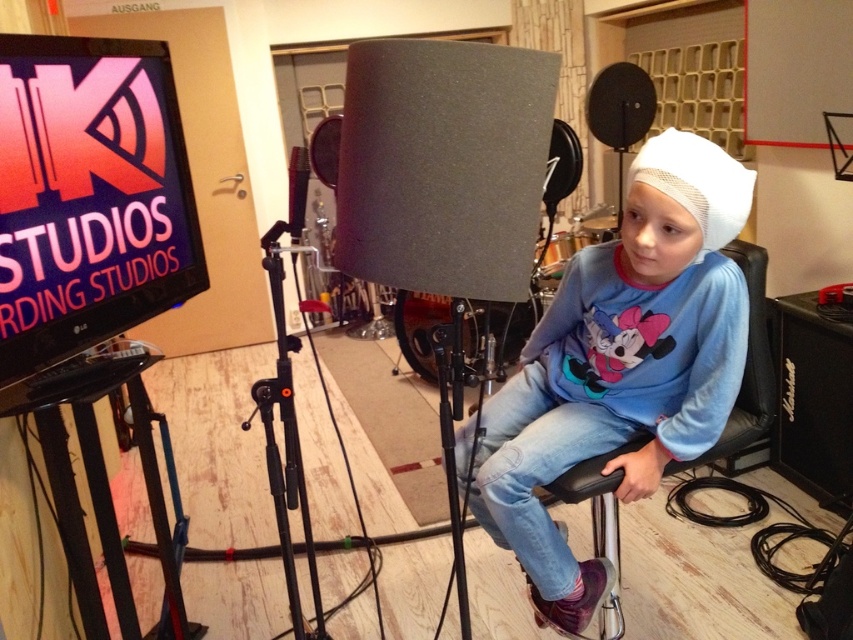
You are an interior designer planning to place a new lamp in the recording studio. The lamp needs to be positioned such that it doesn not cast a shadow on the white mesh hat at center. Given that the lamp will be placed at point A, which is at coordinates different from the hat, where should you position the lamp relative to the hat to avoid casting a shadow?

The white mesh hat at center is located at point (619, 364). To avoid casting a shadow on it, the lamp should be positioned in a direction away from the light source, ensuring the light hits the hat directly without obstruction. Since the exact light source direction isn specified, a safe placement would be either to the side or behind the hat, maintaining a clear line of sight between the light and the hat.

You are a sound engineer in the recording studio. You need to adjust the microphone position to ensure optimal sound quality. The microphone is located at point A, which is point (576, 586), and the singer is at point B, which is point (280, 337). Which point is closer to the viewer, and should you move the microphone closer or farther away from the viewer to position it correctly?

Point A, which is point (576, 586), is closer to the viewer than point B, which is point (280, 337). Since the microphone is at point A and the singer is at point B, you should move the microphone farther away from the viewer to position it closer to the singer at point B.

You are an assistant in the recording studio. You need to adjust the microphone stand, which is attached to the black metal tripod at center. To do this, you must first move the white mesh hat at center out of the way. In which direction should you move the hat to access the tripod?

The white mesh hat at center is to the right of the black metal tripod at center. To access the tripod, move the hat to the left.